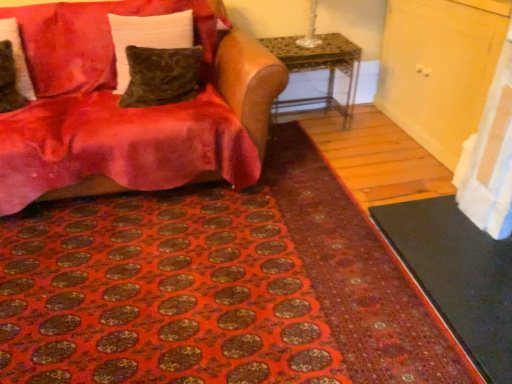
Measure the distance between velvet red couch at upper left and camera.

The distance of velvet red couch at upper left from camera is 1.94 meters.

Image resolution: width=512 pixels, height=384 pixels. I want to click on velvet red couch at upper left, so click(x=130, y=109).

The width and height of the screenshot is (512, 384). Describe the element at coordinates (217, 288) in the screenshot. I see `patterned carpet at lower center` at that location.

What do you see at coordinates (458, 276) in the screenshot? The width and height of the screenshot is (512, 384). I see `black rubber doormat at lower right` at bounding box center [458, 276].

Describe the element at coordinates (320, 68) in the screenshot. This screenshot has width=512, height=384. I see `metallic mosaic table at center` at that location.

Where is `velvet brown pillow at left, which ranks as the first pillow in left-to-right order`? Image resolution: width=512 pixels, height=384 pixels. velvet brown pillow at left, which ranks as the first pillow in left-to-right order is located at coordinates (17, 57).

Describe the element at coordinates (17, 57) in the screenshot. Image resolution: width=512 pixels, height=384 pixels. I see `velvet brown pillow at left, the third pillow in the right-to-left sequence` at that location.

Describe the element at coordinates (148, 38) in the screenshot. I see `velvet green pillow at upper left, which appears as the second pillow when viewed from the right` at that location.

The image size is (512, 384). In order to click on velvet green pillow at upper left, the 2th pillow from the left in this screenshot , I will do `click(148, 38)`.

Image resolution: width=512 pixels, height=384 pixels. In order to click on velvet red couch at upper left in this screenshot , I will do pyautogui.click(x=130, y=109).

Could you tell me if velvet green pillow at center, the first pillow in the right-to-left sequence, is facing velvet red couch at upper left?

Yes.

Which of these two, velvet green pillow at center, the first pillow in the right-to-left sequence, or velvet red couch at upper left, is thinner?

velvet green pillow at center, the first pillow in the right-to-left sequence.

What's the angular difference between velvet green pillow at center, the 3th pillow positioned from the left, and velvet red couch at upper left's facing directions?

0.000134 degrees separate the facing orientations of velvet green pillow at center, the 3th pillow positioned from the left, and velvet red couch at upper left.

Based on the photo, from a real-world perspective, relative to metallic mosaic table at center, is velvet red couch at upper left vertically above or below?

Clearly, from a real-world perspective, velvet red couch at upper left is above metallic mosaic table at center.

Between velvet red couch at upper left and metallic mosaic table at center, which one has smaller size?

Smaller between the two is metallic mosaic table at center.

Is point (101, 92) farther from viewer compared to point (329, 91)?

That is False.

Is velvet red couch at upper left at the right side of metallic mosaic table at center?

In fact, velvet red couch at upper left is to the left of metallic mosaic table at center.

Does point (17, 27) appear closer or farther from the camera than point (192, 47)?

Point (17, 27) appears to be closer to the viewer than point (192, 47).

Is velvet brown pillow at left, which ranks as the first pillow in left-to-right order, next to velvet green pillow at center, the first pillow in the right-to-left sequence?

No, velvet brown pillow at left, which ranks as the first pillow in left-to-right order, is not next to velvet green pillow at center, the first pillow in the right-to-left sequence.

Identify the location of the 1st pillow behind when counting from the velvet brown pillow at left, which ranks as the first pillow in left-to-right order. (162, 76).

Is patterned carpet at lower center to the left of black rubber doormat at lower right from the viewer's perspective?

Yes.

Is patterned carpet at lower center not close to black rubber doormat at lower right?

That's not correct — patterned carpet at lower center is a little close to black rubber doormat at lower right.

Considering the positions of point (362, 328) and point (439, 295), is point (362, 328) closer or farther from the camera than point (439, 295)?

Point (362, 328) is positioned closer to the camera compared to point (439, 295).

From the image's perspective, which is above, patterned carpet at lower center or black rubber doormat at lower right?

patterned carpet at lower center.

Is velvet green pillow at center, the 3th pillow positioned from the left, not near patterned carpet at lower center?

No, velvet green pillow at center, the 3th pillow positioned from the left, is not far away from patterned carpet at lower center.

Could you tell me if velvet green pillow at center, the 3th pillow positioned from the left, is facing patterned carpet at lower center?

No.

From a real-world perspective, does velvet green pillow at center, the first pillow in the right-to-left sequence, stand above patterned carpet at lower center?

Yes.

Does metallic mosaic table at center have a larger size compared to velvet green pillow at center, the first pillow in the right-to-left sequence?

Yes, metallic mosaic table at center is bigger than velvet green pillow at center, the first pillow in the right-to-left sequence.

Is metallic mosaic table at center at the left side of velvet green pillow at center, the 3th pillow positioned from the left?

In fact, metallic mosaic table at center is to the right of velvet green pillow at center, the 3th pillow positioned from the left.

Which is less distant, (265, 44) or (151, 104)?

The point (151, 104) is in front.

The image size is (512, 384). Find the location of `table behind the velvet green pillow at center, the 3th pillow positioned from the left`. table behind the velvet green pillow at center, the 3th pillow positioned from the left is located at coordinates (320, 68).

Does velvet brown pillow at left, which ranks as the first pillow in left-to-right order, turn towards velvet green pillow at upper left, which appears as the second pillow when viewed from the right?

No, velvet brown pillow at left, which ranks as the first pillow in left-to-right order, is not turned towards velvet green pillow at upper left, which appears as the second pillow when viewed from the right.

Is velvet brown pillow at left, which ranks as the first pillow in left-to-right order, directly adjacent to velvet green pillow at upper left, which appears as the second pillow when viewed from the right?

No, velvet brown pillow at left, which ranks as the first pillow in left-to-right order, is not making contact with velvet green pillow at upper left, which appears as the second pillow when viewed from the right.

Where is `studio couch below the velvet green pillow at center, the 3th pillow positioned from the left (from a real-world perspective)`? The image size is (512, 384). studio couch below the velvet green pillow at center, the 3th pillow positioned from the left (from a real-world perspective) is located at coordinates (130, 109).

This screenshot has width=512, height=384. I want to click on studio couch on the left of metallic mosaic table at center, so click(130, 109).

Which object lies nearer to the anchor point patterned carpet at lower center, velvet green pillow at upper left, which appears as the second pillow when viewed from the right, or velvet brown pillow at left, which ranks as the first pillow in left-to-right order?

velvet green pillow at upper left, which appears as the second pillow when viewed from the right.

From the picture: Looking at the image, which one is located closer to patterned carpet at lower center, velvet green pillow at center, the 3th pillow positioned from the left, or velvet red couch at upper left?

Based on the image, velvet red couch at upper left appears to be nearer to patterned carpet at lower center.

Looking at the image, which one is located closer to patterned carpet at lower center, black rubber doormat at lower right or velvet green pillow at upper left, the 2th pillow from the left?

black rubber doormat at lower right is positioned closer to the anchor patterned carpet at lower center.

In the scene shown: Looking at the image, which one is located further to patterned carpet at lower center, velvet brown pillow at left, which ranks as the first pillow in left-to-right order, or velvet red couch at upper left?

Based on the image, velvet brown pillow at left, which ranks as the first pillow in left-to-right order, appears to be further to patterned carpet at lower center.

Based on their spatial positions, is velvet green pillow at upper left, which appears as the second pillow when viewed from the right, or metallic mosaic table at center further from patterned carpet at lower center?

metallic mosaic table at center.

From the image, which object appears to be nearer to metallic mosaic table at center, patterned carpet at lower center or velvet green pillow at upper left, which appears as the second pillow when viewed from the right?

The object closer to metallic mosaic table at center is velvet green pillow at upper left, which appears as the second pillow when viewed from the right.

Which object lies nearer to the anchor point black rubber doormat at lower right, velvet brown pillow at left, which ranks as the first pillow in left-to-right order, or patterned carpet at lower center?

Among the two, patterned carpet at lower center is located nearer to black rubber doormat at lower right.

Looking at the image, which one is located further to patterned carpet at lower center, velvet green pillow at upper left, the 2th pillow from the left, or black rubber doormat at lower right?

Based on the image, velvet green pillow at upper left, the 2th pillow from the left, appears to be further to patterned carpet at lower center.

Locate an element on the screen. Image resolution: width=512 pixels, height=384 pixels. studio couch situated between velvet brown pillow at left, which ranks as the first pillow in left-to-right order, and velvet green pillow at upper left, which appears as the second pillow when viewed from the right, from left to right is located at coordinates (130, 109).

The image size is (512, 384). What are the coordinates of `mat between velvet red couch at upper left and black rubber doormat at lower right` in the screenshot? It's located at (217, 288).

Where is `pillow positioned between patterned carpet at lower center and velvet green pillow at center, the first pillow in the right-to-left sequence, from near to far`? The height and width of the screenshot is (384, 512). pillow positioned between patterned carpet at lower center and velvet green pillow at center, the first pillow in the right-to-left sequence, from near to far is located at coordinates (17, 57).

Locate an element on the screen. The image size is (512, 384). pillow between velvet green pillow at upper left, which appears as the second pillow when viewed from the right, and metallic mosaic table at center, in the horizontal direction is located at coordinates (162, 76).